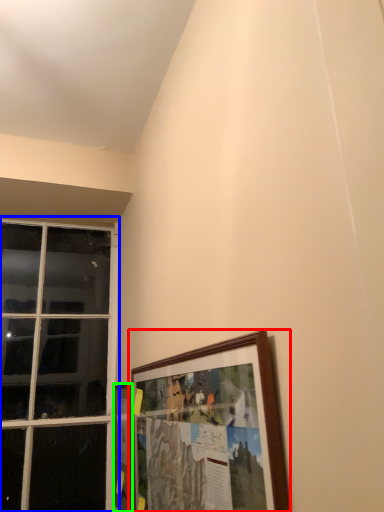
Question: Based on their relative distances, which object is farther from picture frame (highlighted by a red box)? Choose from window (highlighted by a blue box) and picture frame (highlighted by a green box).

Choices:
 (A) window
 (B) picture frame

Answer: (A)